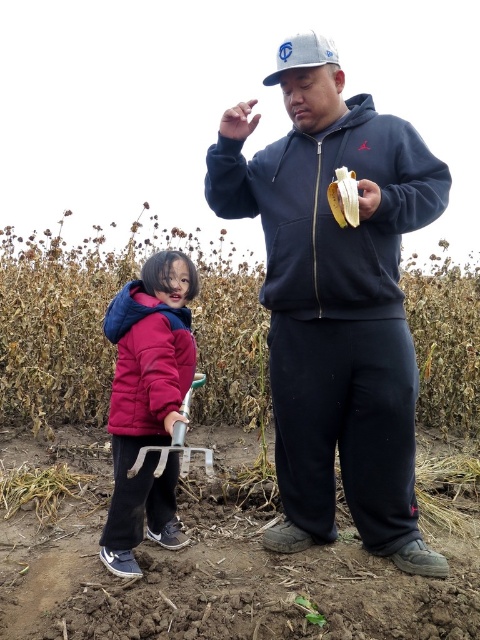
Question: Does dark blue zip-up hoodie at center have a larger size compared to brown dry corn field at center?

Choices:
 (A) yes
 (B) no

Answer: (A)

Question: Where is dark blue zip-up hoodie at center located in relation to brown dry corn field at center in the image?

Choices:
 (A) below
 (B) above

Answer: (B)

Question: Which point is closer to the camera?

Choices:
 (A) yellow matte banana at center
 (B) brown soil at center
 (C) brown dry corn field at center
 (D) white matte baseball cap at upper center

Answer: (B)

Question: From the image, what is the correct spatial relationship of dark blue zip-up hoodie at center in relation to yellow matte banana at center?

Choices:
 (A) right
 (B) left

Answer: (B)

Question: Which of the following is the farthest from the observer?

Choices:
 (A) brown dry corn field at center
 (B) white matte baseball cap at upper center
 (C) dark blue zip-up hoodie at center

Answer: (A)

Question: Considering the real-world distances, which object is farthest from the brown soil at center?

Choices:
 (A) brown dry corn field at center
 (B) dark blue zip-up hoodie at center
 (C) yellow matte banana at center
 (D) velvet maroon jacket at lower left

Answer: (A)